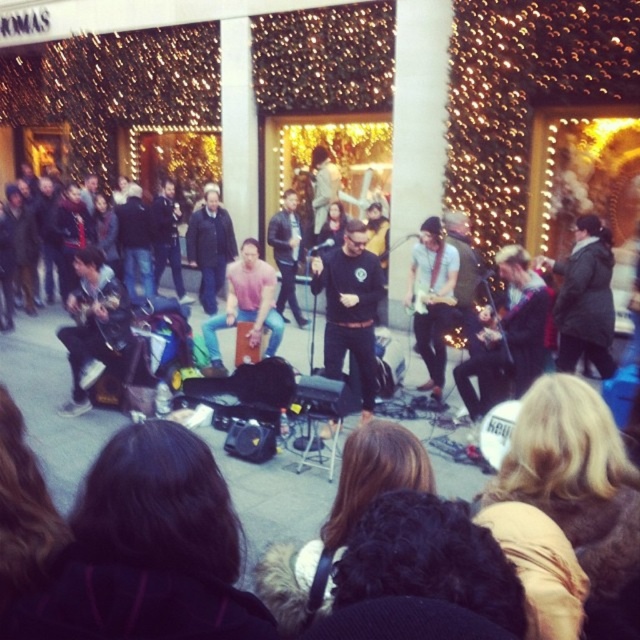
Question: Can you confirm if black matte shirt at center is smaller than pink cotton shirt at center?

Choices:
 (A) no
 (B) yes

Answer: (B)

Question: Is pink cotton shirt at center above black leather jacket at center?

Choices:
 (A) yes
 (B) no

Answer: (B)

Question: Which point appears closest to the camera in this image?

Choices:
 (A) (333, 353)
 (B) (289, 264)

Answer: (A)

Question: Estimate the real-world distances between objects in this image. Which object is farther from the black leather jacket at center?

Choices:
 (A) black matte shirt at center
 (B) pink cotton shirt at center

Answer: (A)

Question: Does black matte shirt at center appear over black leather jacket at center?

Choices:
 (A) yes
 (B) no

Answer: (B)

Question: Which object is positioned farthest from the black matte shirt at center?

Choices:
 (A) black leather jacket at center
 (B) pink cotton shirt at center

Answer: (A)